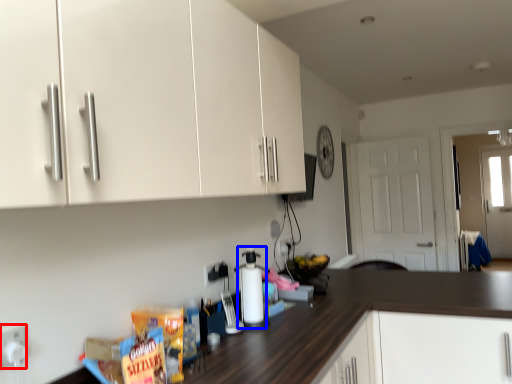
Question: Which of the following is the closest to the observer, electric outlet (highlighted by a red box) or bottle (highlighted by a blue box)?

Choices:
 (A) electric outlet
 (B) bottle

Answer: (A)